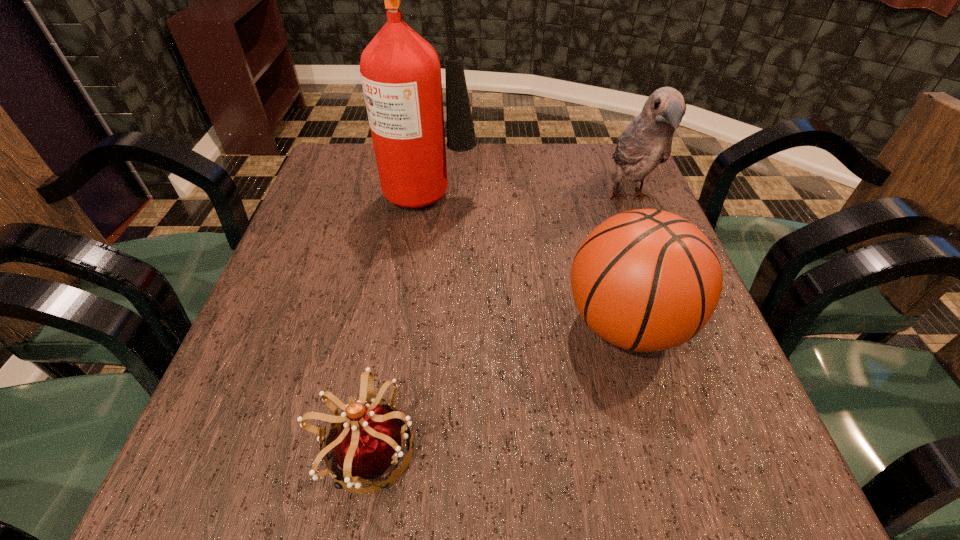
This screenshot has height=540, width=960. What are the coordinates of `fire extinguisher that is at the far edge` in the screenshot? It's located at (400, 71).

In order to click on parrot situated at the far edge in this screenshot , I will do `click(647, 141)`.

At what (x,y) coordinates should I click in order to perform the action: click on object that is at the near edge. Please return your answer as a coordinate pair (x, y). Looking at the image, I should click on (369, 441).

Locate an element on the screen. This screenshot has height=540, width=960. parrot located at the right edge is located at coordinates (647, 141).

Locate an element on the screen. The width and height of the screenshot is (960, 540). basketball at the right edge is located at coordinates (646, 280).

The image size is (960, 540). In order to click on object positioned at the far right corner in this screenshot , I will do `click(647, 141)`.

I want to click on free space at the far edge of the desktop, so click(x=530, y=187).

Where is `free region at the near edge`? The image size is (960, 540). free region at the near edge is located at coordinates (391, 506).

Find the location of a particular element. vacant space at the left edge of the desktop is located at coordinates (321, 308).

In the image, there is a desktop. Where is `vacant space at the right edge`? This screenshot has width=960, height=540. vacant space at the right edge is located at coordinates (598, 215).